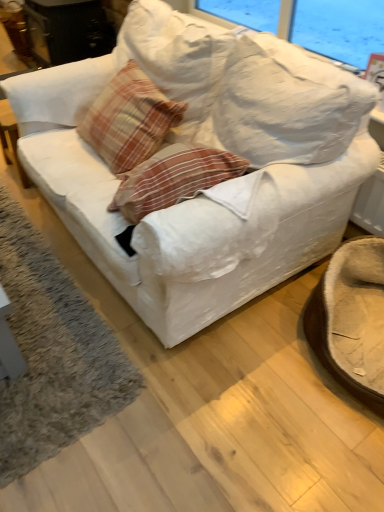
Question: Is soft gray carpet at lower left positioned with its back to white fabric couch at center?

Choices:
 (A) yes
 (B) no

Answer: (B)

Question: Does soft gray carpet at lower left appear on the right side of white fabric couch at center?

Choices:
 (A) yes
 (B) no

Answer: (B)

Question: Is soft gray carpet at lower left in front of white fabric couch at center?

Choices:
 (A) yes
 (B) no

Answer: (B)

Question: Considering the relative sizes of soft gray carpet at lower left and white fabric couch at center in the image provided, is soft gray carpet at lower left wider than white fabric couch at center?

Choices:
 (A) no
 (B) yes

Answer: (B)

Question: Would you say soft gray carpet at lower left contains white fabric couch at center?

Choices:
 (A) no
 (B) yes

Answer: (A)

Question: Considering the relative sizes of soft gray carpet at lower left and white fabric couch at center in the image provided, is soft gray carpet at lower left taller than white fabric couch at center?

Choices:
 (A) no
 (B) yes

Answer: (A)

Question: Is white fabric couch at center looking in the opposite direction of plaid fabric pillow at center?

Choices:
 (A) yes
 (B) no

Answer: (A)

Question: Can you confirm if white fabric couch at center is positioned to the right of plaid fabric pillow at center?

Choices:
 (A) yes
 (B) no

Answer: (A)

Question: From a real-world perspective, is white fabric couch at center beneath plaid fabric pillow at center?

Choices:
 (A) yes
 (B) no

Answer: (A)

Question: Is white fabric couch at center wider than plaid fabric pillow at center?

Choices:
 (A) no
 (B) yes

Answer: (B)

Question: Is white fabric couch at center positioned beyond the bounds of plaid fabric pillow at center?

Choices:
 (A) yes
 (B) no

Answer: (A)

Question: Does white fabric couch at center have a lesser height compared to plaid fabric pillow at center?

Choices:
 (A) no
 (B) yes

Answer: (A)

Question: From a real-world perspective, is white fabric couch at center physically above brown fuzzy swivel chair at lower right?

Choices:
 (A) no
 (B) yes

Answer: (B)